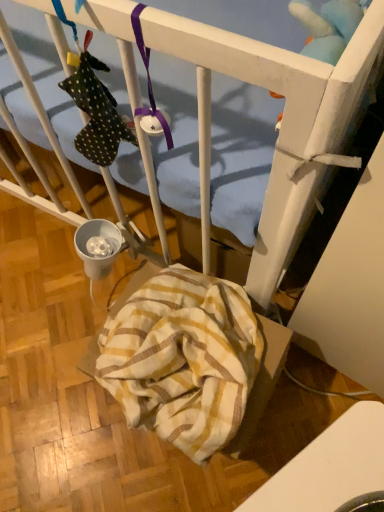
Question: Is blue plush toy at upper right wider than white glossy table at lower right?

Choices:
 (A) no
 (B) yes

Answer: (A)

Question: Is blue plush toy at upper right next to white glossy table at lower right and touching it?

Choices:
 (A) no
 (B) yes

Answer: (A)

Question: Considering the relative sizes of blue plush toy at upper right and white glossy table at lower right in the image provided, is blue plush toy at upper right taller than white glossy table at lower right?

Choices:
 (A) yes
 (B) no

Answer: (B)

Question: Is blue plush toy at upper right at the right side of white glossy table at lower right?

Choices:
 (A) no
 (B) yes

Answer: (B)

Question: Is blue plush toy at upper right closer to the viewer compared to white glossy table at lower right?

Choices:
 (A) yes
 (B) no

Answer: (B)

Question: Is white glossy table at lower right a part of blue plush toy at upper right?

Choices:
 (A) yes
 (B) no

Answer: (B)

Question: From a real-world perspective, does white glossy table at lower right sit lower than yellow striped fabric at lower center?

Choices:
 (A) no
 (B) yes

Answer: (A)

Question: Could you tell me if white glossy table at lower right is facing yellow striped fabric at lower center?

Choices:
 (A) no
 (B) yes

Answer: (A)

Question: From the image's perspective, is white glossy table at lower right located above yellow striped fabric at lower center?

Choices:
 (A) no
 (B) yes

Answer: (A)

Question: From the image's perspective, is white glossy table at lower right located beneath yellow striped fabric at lower center?

Choices:
 (A) yes
 (B) no

Answer: (A)

Question: Is yellow striped fabric at lower center at the back of white glossy table at lower right?

Choices:
 (A) no
 (B) yes

Answer: (A)

Question: Does white glossy table at lower right have a greater width compared to yellow striped fabric at lower center?

Choices:
 (A) no
 (B) yes

Answer: (B)

Question: Can you confirm if blue plush toy at upper right is positioned to the right of yellow striped fabric at lower center?

Choices:
 (A) yes
 (B) no

Answer: (A)